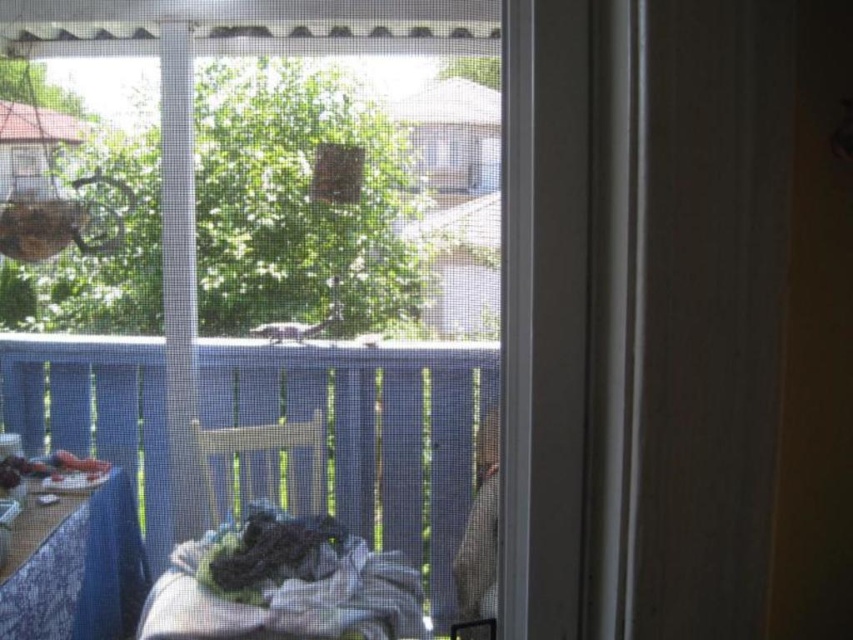
Is point (345, 144) farther from camera compared to point (73, 586)?

That is False.

In the scene shown: Who is positioned more to the left, transparent plastic window at center or wooden table at lower left?

From the viewer's perspective, wooden table at lower left appears more on the left side.

Which is behind, point (386, 138) or point (32, 595)?

Positioned behind is point (32, 595).

The height and width of the screenshot is (640, 853). Find the location of `transparent plastic window at center`. transparent plastic window at center is located at coordinates (253, 294).